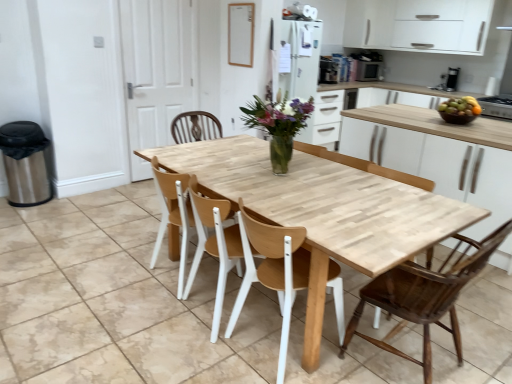
Question: Visually, is shiny brown bowl at right positioned to the left or to the right of light wood table at center?

Choices:
 (A) right
 (B) left

Answer: (A)

Question: Is shiny brown bowl at right wider or thinner than light wood table at center?

Choices:
 (A) thin
 (B) wide

Answer: (A)

Question: Considering the real-world distances, which object is farthest from the dark brown wood chair at center, which is the third chair in left-to-right order?

Choices:
 (A) shiny brown bowl at right
 (B) wooden at center, the second chair viewed from the left
 (C) translucent glass vase at center
 (D) metallic silver stove at right, the third appliance from the top
 (E) wooden at center, the third chair viewed from the right

Answer: (D)

Question: Based on their relative distances, which object is farther from the wooden at center, the third chair viewed from the right?

Choices:
 (A) shiny brown bowl at right
 (B) white matte cabinet at upper right
 (C) metallic silver stove at right, the third appliance viewed from the back
 (D) dark brown wood chair at center, which is the third chair in left-to-right order
 (E) light wood table at center

Answer: (B)